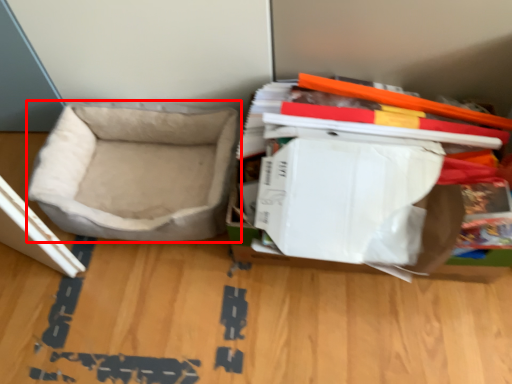
Question: From the image's perspective, what is the correct spatial relationship of dog bed (annotated by the red box) in relation to storage box?

Choices:
 (A) below
 (B) above

Answer: (B)